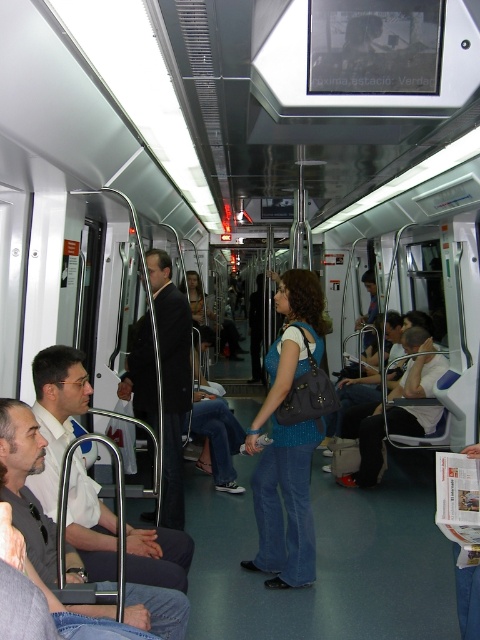
Question: Among these points, which one is nearest to the camera?

Choices:
 (A) (420, 333)
 (B) (168, 364)
 (C) (287, 445)
 (D) (75, 349)

Answer: (D)

Question: Which object appears farthest from the camera in this image?

Choices:
 (A) white shirt at left
 (B) black suit coat at center

Answer: (B)

Question: Can you confirm if white shirt at left is thinner than black suit coat at center?

Choices:
 (A) no
 (B) yes

Answer: (A)

Question: Which point appears farthest from the camera in this image?

Choices:
 (A) (152, 419)
 (B) (50, 412)
 (C) (265, 364)
 (D) (395, 397)

Answer: (D)

Question: In this image, where is knitted blue sweater at center located relative to denim jeans at center?

Choices:
 (A) below
 (B) above

Answer: (B)

Question: Is white shirt at left thinner than denim jeans at center?

Choices:
 (A) no
 (B) yes

Answer: (B)